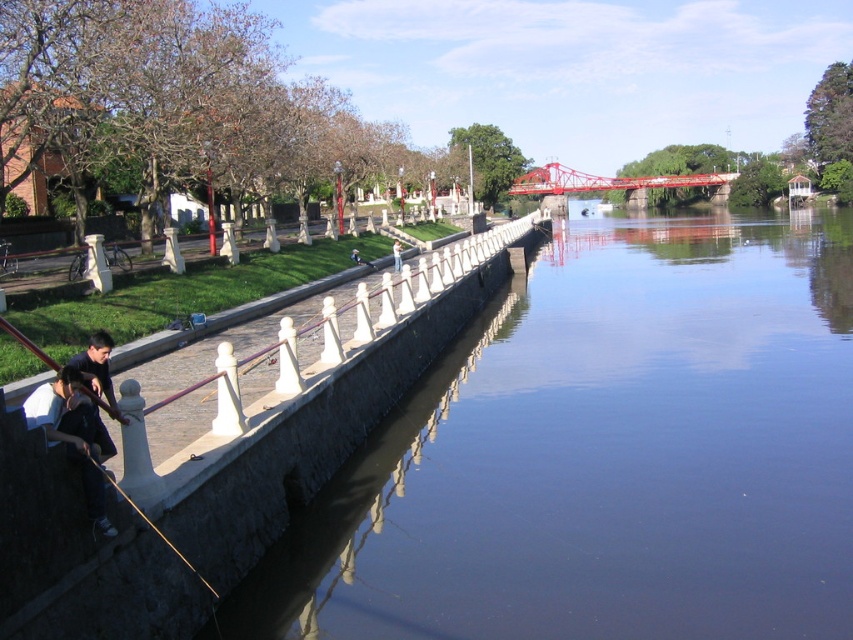
Question: Which point is farther to the camera?

Choices:
 (A) [67, 403]
 (B) [396, 244]
 (C) [480, 449]
 (D) [190, 568]

Answer: (B)

Question: Which point is closer to the camera?

Choices:
 (A) (587, 509)
 (B) (96, 464)
 (C) (398, 244)
 (D) (73, 417)

Answer: (D)

Question: Does smooth white pole at lower left have a smaller size compared to light brown wooden pole at center?

Choices:
 (A) yes
 (B) no

Answer: (A)

Question: Can you confirm if dark blue fabric at lower left is thinner than light brown wooden pole at center?

Choices:
 (A) no
 (B) yes

Answer: (B)

Question: Is smooth concrete water at center to the right of dark blue fabric at lower left from the viewer's perspective?

Choices:
 (A) yes
 (B) no

Answer: (A)

Question: Which point is closer to the camera taking this photo?

Choices:
 (A) (49, 404)
 (B) (401, 259)

Answer: (A)